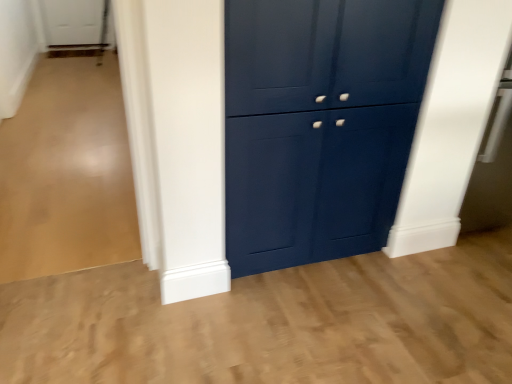
This screenshot has width=512, height=384. What are the coordinates of `space that is in front of glossy blue cupboard at center` in the screenshot? It's located at (320, 321).